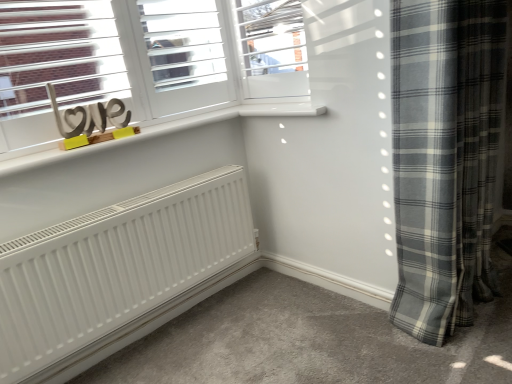
Question: Does gray plaid curtain at right have a lesser height compared to wooden love sign at upper left?

Choices:
 (A) yes
 (B) no

Answer: (B)

Question: Considering the relative sizes of gray plaid curtain at right and wooden love sign at upper left in the image provided, is gray plaid curtain at right smaller than wooden love sign at upper left?

Choices:
 (A) yes
 (B) no

Answer: (B)

Question: From a real-world perspective, is gray plaid curtain at right beneath wooden love sign at upper left?

Choices:
 (A) no
 (B) yes

Answer: (B)

Question: From a real-world perspective, is gray plaid curtain at right over wooden love sign at upper left?

Choices:
 (A) yes
 (B) no

Answer: (B)

Question: Is the depth of gray plaid curtain at right greater than that of wooden love sign at upper left?

Choices:
 (A) no
 (B) yes

Answer: (A)

Question: Is gray plaid curtain at right wider than wooden love sign at upper left?

Choices:
 (A) no
 (B) yes

Answer: (B)

Question: Is gray plaid curtain at right closer to the viewer compared to white frosted glass window at upper center?

Choices:
 (A) yes
 (B) no

Answer: (A)

Question: Does gray plaid curtain at right have a greater width compared to white frosted glass window at upper center?

Choices:
 (A) yes
 (B) no

Answer: (A)

Question: Is gray plaid curtain at right at the right side of white frosted glass window at upper center?

Choices:
 (A) yes
 (B) no

Answer: (A)

Question: Could you tell me if gray plaid curtain at right is turned towards white frosted glass window at upper center?

Choices:
 (A) no
 (B) yes

Answer: (A)

Question: From a real-world perspective, is gray plaid curtain at right over white frosted glass window at upper center?

Choices:
 (A) yes
 (B) no

Answer: (B)

Question: From the image's perspective, is gray plaid curtain at right beneath white frosted glass window at upper center?

Choices:
 (A) yes
 (B) no

Answer: (A)

Question: Is wooden love sign at upper left not close to gray plaid curtain at right?

Choices:
 (A) no
 (B) yes

Answer: (B)